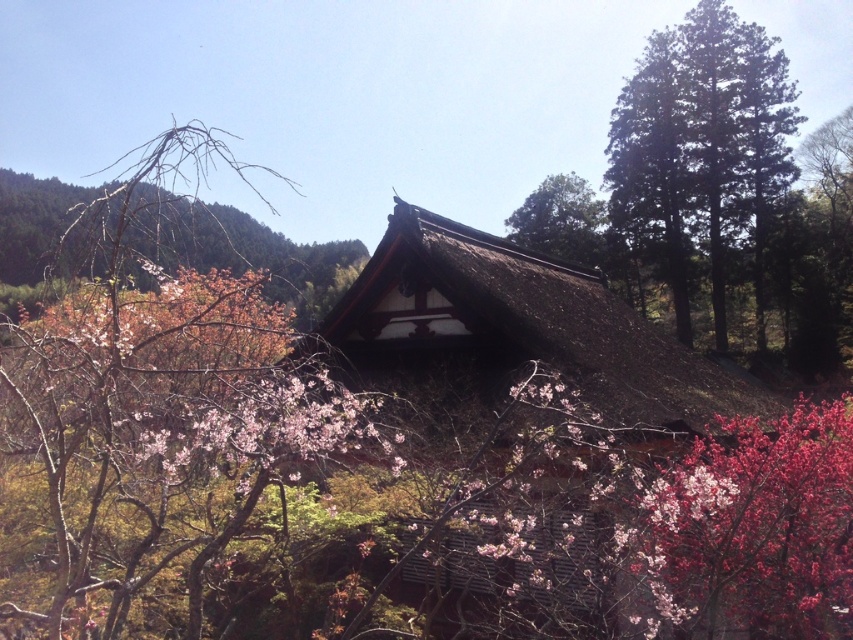
Consider the image. You are a visitor standing in front of the traditional Japanese building. You notice the brown thatched roof at center and the bare branches at left. Which object is positioned lower in the scene?

The brown thatched roof at center is located below bare branches at left, so it is positioned lower in the scene.

You are standing in front of the traditional Japanese building and want to take a photo of the brown thatched roof at center and the green leafy tree at upper center. Which object should you focus on first if you want to capture both in a single frame without moving the camera?

You should focus on the brown thatched roof at center first because it is located below the green leafy tree at upper center, so adjusting the camera to include both would require framing from the lower to the upper part of the scene.

You are standing in front of the traditional Japanese building and notice two elements in the scene. You see the bare branches at left and the pink matte flower at center. Which of these two elements is positioned more to the left side of the scene?

The bare branches at left are positioned more to the left side of the scene compared to the pink matte flower at center.